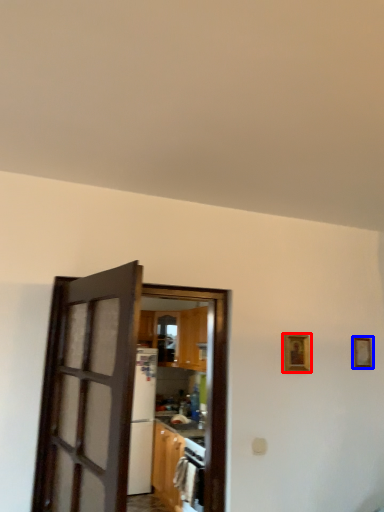
Question: Which object is further to the camera taking this photo, picture frame (highlighted by a red box) or picture frame (highlighted by a blue box)?

Choices:
 (A) picture frame
 (B) picture frame

Answer: (B)